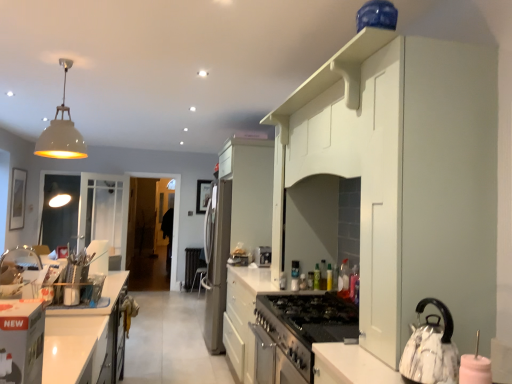
Find the location of a particular element. This screenshot has width=512, height=384. satin silver toaster at center, which ranks as the third appliance in top-to-bottom order is located at coordinates (263, 256).

How much space does white glossy cabinet at center, positioned as the 2th cabinetry in top-to-bottom order, occupy horizontally?

white glossy cabinet at center, positioned as the 2th cabinetry in top-to-bottom order, is 25.72 inches in width.

I want to click on white matte cabinet at upper right, marked as the first cabinetry in a front-to-back arrangement, so click(x=406, y=175).

What do you see at coordinates (343, 276) in the screenshot? I see `translucent plastic bottle at center, acting as the 2th bottle starting from the front` at bounding box center [343, 276].

Find the location of a particular element. This screenshot has width=512, height=384. white glossy countertop at lower left is located at coordinates (78, 349).

This screenshot has height=384, width=512. What do you see at coordinates (78, 349) in the screenshot?
I see `white glossy countertop at lower left` at bounding box center [78, 349].

I want to click on satin silver toaster at center, which is counted as the second appliance, starting from the left, so click(x=263, y=256).

Consider the image. Is white glossy cabinet at center, positioned as the 2th cabinetry in top-to-bottom order, positioned behind white glossy countertop at lower left?

Yes, it is behind white glossy countertop at lower left.

Is white glossy cabinet at center, the 1th cabinetry when ordered from left to right, inside the boundaries of white glossy countertop at lower left, or outside?

white glossy cabinet at center, the 1th cabinetry when ordered from left to right, exists outside the volume of white glossy countertop at lower left.

Looking at this image, could you tell me if white glossy cabinet at center, positioned as the 2th cabinetry in top-to-bottom order, is facing white glossy countertop at lower left?

No, white glossy cabinet at center, positioned as the 2th cabinetry in top-to-bottom order, is not facing towards white glossy countertop at lower left.

Between blue glossy jar at upper center, which is the fourth appliance in back-to-front order, and white glossy countertop at lower left, which one appears on the right side from the viewer's perspective?

blue glossy jar at upper center, which is the fourth appliance in back-to-front order, is more to the right.

Is blue glossy jar at upper center, the 1th appliance in the right-to-left sequence, closer to the viewer compared to white glossy countertop at lower left?

Yes, it is in front of white glossy countertop at lower left.

Which of these two, blue glossy jar at upper center, the fourth appliance in the left-to-right sequence, or white glossy countertop at lower left, stands shorter?

With less height is blue glossy jar at upper center, the fourth appliance in the left-to-right sequence.

How different are the orientations of blue glossy jar at upper center, which is counted as the first appliance, starting from the top, and white glossy countertop at lower left in degrees?

180 degrees.

From the image's perspective, is white glossy cabinet at center, which is the first cabinetry in back-to-front order, on top of white marble kettle at lower right?

No, from the image's perspective, white glossy cabinet at center, which is the first cabinetry in back-to-front order, is not over white marble kettle at lower right.

Considering the sizes of objects white glossy cabinet at center, arranged as the 1th cabinetry when ordered from the bottom, and white marble kettle at lower right in the image provided, who is wider, white glossy cabinet at center, arranged as the 1th cabinetry when ordered from the bottom, or white marble kettle at lower right?

Wider between the two is white glossy cabinet at center, arranged as the 1th cabinetry when ordered from the bottom.

Who is bigger, white glossy cabinet at center, positioned as the 2th cabinetry in top-to-bottom order, or white marble kettle at lower right?

white glossy cabinet at center, positioned as the 2th cabinetry in top-to-bottom order, is bigger.

From a real-world perspective, is white marble kettle at lower right positioned over white glossy cabinet at center, the 1th cabinetry when ordered from left to right, based on gravity?

Indeed, from a real-world perspective, white marble kettle at lower right stands above white glossy cabinet at center, the 1th cabinetry when ordered from left to right.

In order to click on kitchen appliance above the white glossy cabinet at center, arranged as the 1th cabinetry when ordered from the bottom (from the image's perspective) in this screenshot , I will do `click(431, 349)`.

From the image's perspective, which is above, white marble kettle at lower right or white glossy cabinet at center, the second cabinetry when ordered from front to back?

white marble kettle at lower right is shown above in the image.

From a real-world perspective, which object stands above the other?

satin silver toaster at center, which is counted as the second appliance, starting from the left, is physically above.

Which of these two, satin silver toaster at center, placed as the second appliance when sorted from bottom to top, or translucent plastic bottle at center, the third bottle positioned from the front, is smaller?

translucent plastic bottle at center, the third bottle positioned from the front.

Considering the positions of points (255, 251) and (316, 263), is point (255, 251) farther from camera compared to point (316, 263)?

Yes, it is behind point (316, 263).

Which is correct: translucent plastic bottle at center, acting as the 4th bottle starting from the back, is inside translucent plastic bottle at center, acting as the fourth bottle starting from the front, or outside of it?

translucent plastic bottle at center, acting as the 4th bottle starting from the back, lies outside translucent plastic bottle at center, acting as the fourth bottle starting from the front.

In the scene shown: Is translucent plastic bottle at center, acting as the 4th bottle starting from the back, turned away from translucent plastic bottle at center, the second bottle in the back-to-front sequence?

translucent plastic bottle at center, acting as the 4th bottle starting from the back, is not turned away from translucent plastic bottle at center, the second bottle in the back-to-front sequence.

Is translucent plastic bottle at center, acting as the 2th bottle starting from the front, with translucent plastic bottle at center, acting as the fourth bottle starting from the front?

No.

Considering the relative sizes of white matte pendant light at upper left and white glossy cabinet at center, arranged as the 1th cabinetry when ordered from the bottom, in the image provided, is white matte pendant light at upper left shorter than white glossy cabinet at center, arranged as the 1th cabinetry when ordered from the bottom,?

Correct, white matte pendant light at upper left is not as tall as white glossy cabinet at center, arranged as the 1th cabinetry when ordered from the bottom.

Is white matte pendant light at upper left far from white glossy cabinet at center, the second cabinetry when ordered from front to back?

white matte pendant light at upper left is positioned a significant distance from white glossy cabinet at center, the second cabinetry when ordered from front to back.

Is white glossy cabinet at center, positioned as the 2th cabinetry in top-to-bottom order, inside white matte pendant light at upper left?

No, white glossy cabinet at center, positioned as the 2th cabinetry in top-to-bottom order, is not a part of white matte pendant light at upper left.

Image resolution: width=512 pixels, height=384 pixels. I want to click on cabinetry below the white glossy countertop at lower left (from a real-world perspective), so click(279, 327).

You are a GUI agent. You are given a task and a screenshot of the screen. Output one action in this format:
    pyautogui.click(x=<x>, y=<y>)
    Task: Click on the counter top on the left of blue glossy jar at upper center, positioned as the first appliance in front-to-back order
    This screenshot has width=512, height=384.
    Given the screenshot: What is the action you would take?
    point(78,349)

From the image, which object appears to be farther from blue glossy jar at upper center, which ranks as the 4th appliance in bottom-to-top order, green matte bottle at center, the 5th bottle viewed from the front, or translucent plastic bottle at center, the second bottle in the back-to-front sequence?

Among the two, translucent plastic bottle at center, the second bottle in the back-to-front sequence, is located further to blue glossy jar at upper center, which ranks as the 4th appliance in bottom-to-top order.

Considering their positions, is green matte bottle at center, the 5th bottle viewed from the front, positioned closer to white matte pendant light at upper left than white glossy countertop at lower left?

white glossy countertop at lower left.

Based on their spatial positions, is satin silver toaster at center, which ranks as the third appliance in top-to-bottom order, or translucent plastic bottle at center, acting as the 2th bottle starting from the front, further from white marble kettle at lower right?

Among the two, satin silver toaster at center, which ranks as the third appliance in top-to-bottom order, is located further to white marble kettle at lower right.

When comparing their distances from white glossy countertop at lower left, does translucent plastic bottle at center, which ranks as the third bottle in back-to-front order, or white matte cabinet at upper right, which ranks as the second cabinetry in back-to-front order, seem further?

translucent plastic bottle at center, which ranks as the third bottle in back-to-front order, is positioned further to the anchor white glossy countertop at lower left.

Which object lies further to the anchor point transparent glass door at center, white glossy cabinet at center, the 1th cabinetry when ordered from left to right, or white marble kettle at lower right?

white marble kettle at lower right is further to transparent glass door at center.

Estimate the real-world distances between objects in this image. Which object is closer to metallic silver stove at center, the third appliance positioned from the back, white matte pendant light at upper left or blue glossy jar at upper center, which is counted as the first appliance, starting from the top?

blue glossy jar at upper center, which is counted as the first appliance, starting from the top.

Looking at the image, which one is located further to satin silver toaster at center, positioned as the 2th appliance in back-to-front order, white glossy countertop at lower left or translucent plastic bottle at center, which ranks as the third bottle in back-to-front order?

The object further to satin silver toaster at center, positioned as the 2th appliance in back-to-front order, is white glossy countertop at lower left.

Looking at the image, which one is located further to translucent plastic bottle at center, the second bottle in the back-to-front sequence, translucent plastic bottle at center, the third bottle positioned from the front, or white marble kettle at lower right?

white marble kettle at lower right is positioned further to the anchor translucent plastic bottle at center, the second bottle in the back-to-front sequence.

Where is `bottle that lies between blue glossy jar at upper center, the fourth appliance in the left-to-right sequence, and translucent plastic bottle at center, the fifth bottle in the back-to-front sequence, from top to bottom`? bottle that lies between blue glossy jar at upper center, the fourth appliance in the left-to-right sequence, and translucent plastic bottle at center, the fifth bottle in the back-to-front sequence, from top to bottom is located at coordinates (343, 276).

Identify the location of appliance between translucent plastic bottle at center, acting as the fourth bottle starting from the front, and satin stainless steel refrigerator at center, arranged as the fourth appliance when viewed from the right, from front to back. The height and width of the screenshot is (384, 512). (263, 256).

Identify the location of kitchen appliance between white matte pendant light at upper left and white matte cabinet at upper right, placed as the first cabinetry when sorted from top to bottom. Image resolution: width=512 pixels, height=384 pixels. (431, 349).

Find the location of a particular element. The width and height of the screenshot is (512, 384). bottle located between metallic silver stove at center, the second appliance positioned from the top, and translucent plastic bottle at center, acting as the fourth bottle starting from the front, in the left-right direction is located at coordinates (317, 277).